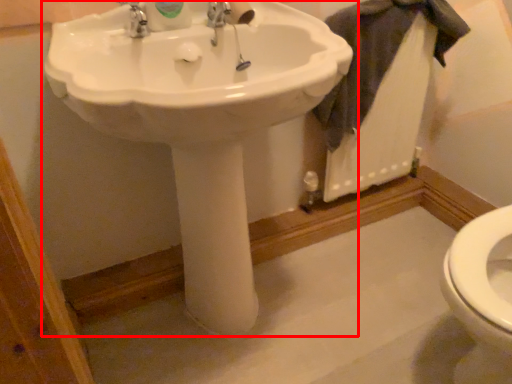
Question: Observing the image, what is the correct spatial positioning of sink (annotated by the red box) in reference to bath towel?

Choices:
 (A) right
 (B) left

Answer: (B)